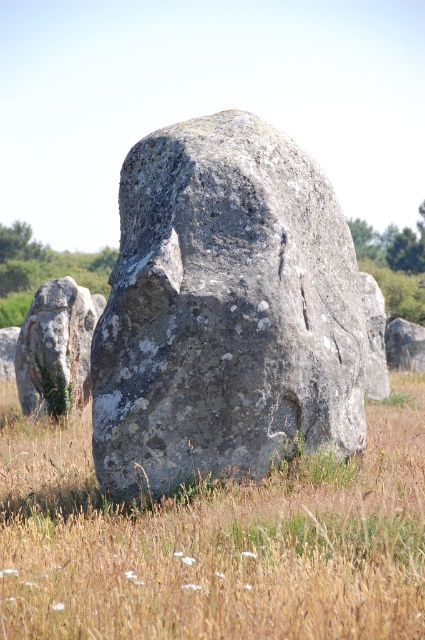
Is gray stone at center to the left of smooth gray rock at left from the viewer's perspective?

In fact, gray stone at center is to the right of smooth gray rock at left.

Measure the distance between gray stone at center and smooth gray rock at left.

gray stone at center and smooth gray rock at left are 6.78 meters apart from each other.

Who is more forward, (255, 556) or (64, 276)?

Point (255, 556)

Where is `gray stone at center`? The width and height of the screenshot is (425, 640). gray stone at center is located at coordinates (215, 540).

Does gray rough stone at center appear over gray stone at center?

Yes, gray rough stone at center is above gray stone at center.

Does point (291, 317) lie behind point (147, 625)?

Yes, it is.

Is point (280, 280) farther from camera compared to point (359, 589)?

Yes, point (280, 280) is farther from viewer.

Find the location of a particular element. The height and width of the screenshot is (640, 425). gray rough stone at center is located at coordinates (224, 310).

Measure the distance between gray rough stone at center and smooth gray rock at left.

gray rough stone at center and smooth gray rock at left are 20.60 feet apart.

Who is more forward, [357,323] or [70,371]?

Positioned in front is point [357,323].

Where is `gray rough stone at center`? gray rough stone at center is located at coordinates (224, 310).